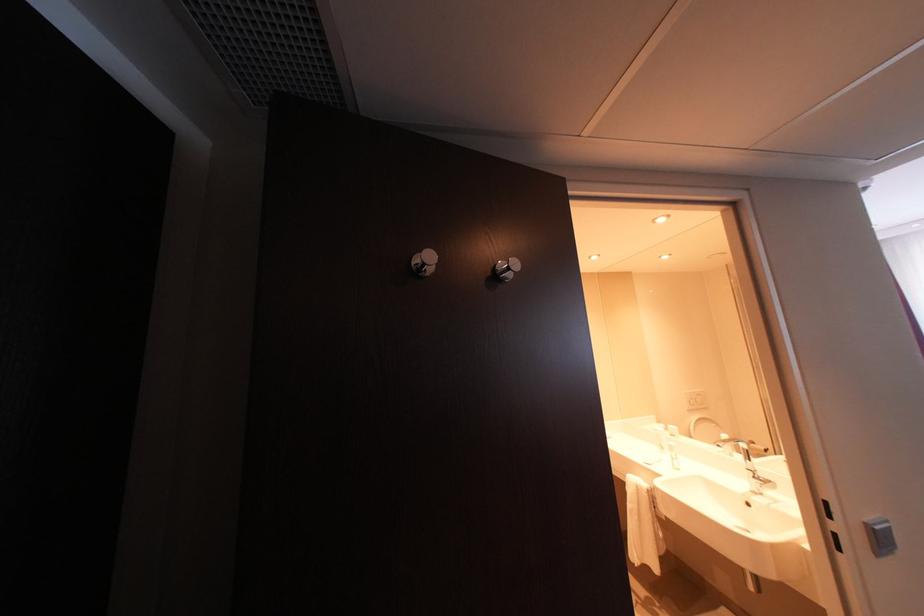
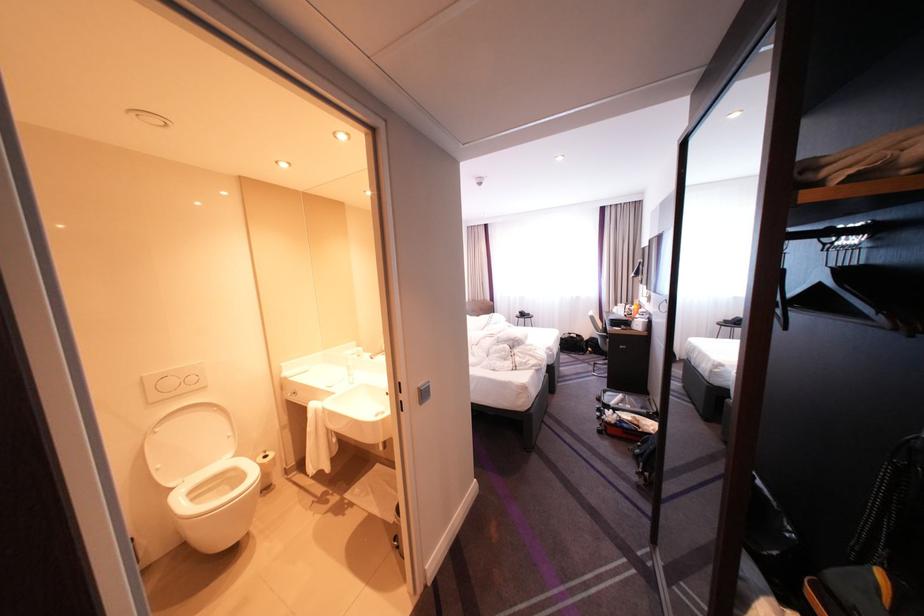
In the second image, find the point that corresponds to (x=641, y=506) in the first image.

(321, 430)